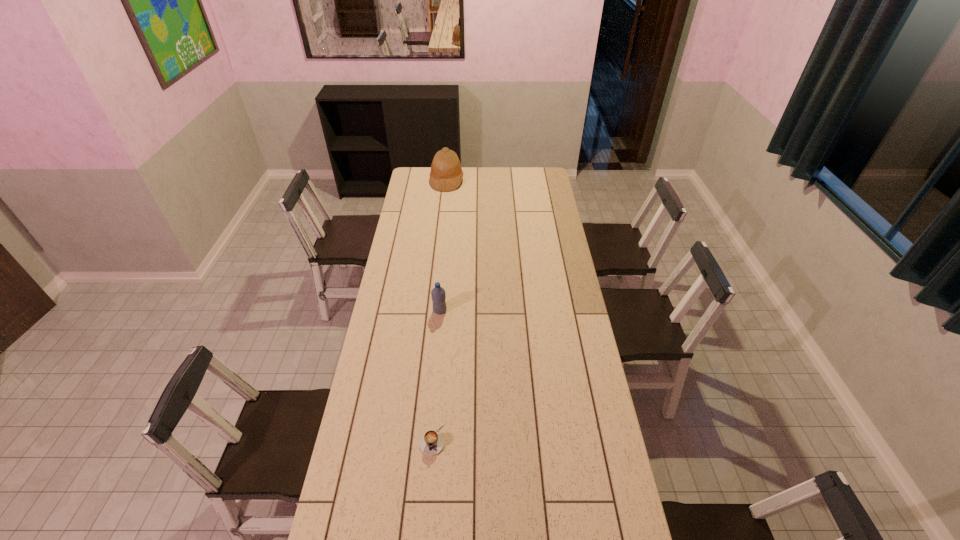
I want to click on the tallest object, so (446, 174).

Locate an element on the screen. The width and height of the screenshot is (960, 540). hat is located at coordinates (446, 174).

Locate an element on the screen. This screenshot has width=960, height=540. water bottle is located at coordinates (438, 295).

Where is `the second nearest object`? This screenshot has width=960, height=540. the second nearest object is located at coordinates (438, 295).

Locate an element on the screen. cappuccino is located at coordinates (431, 443).

Image resolution: width=960 pixels, height=540 pixels. I want to click on the shortest object, so click(431, 443).

Locate an element on the screen. vacant position located on the front-facing side of the farthest object is located at coordinates (500, 181).

This screenshot has width=960, height=540. I want to click on free location located 0.350m on the right of the second shortest object, so click(x=525, y=310).

Where is `vacant space situated with the handle on the side of the nearest object`? Image resolution: width=960 pixels, height=540 pixels. vacant space situated with the handle on the side of the nearest object is located at coordinates (426, 513).

Find the location of a particular element. object that is at the far edge is located at coordinates (446, 174).